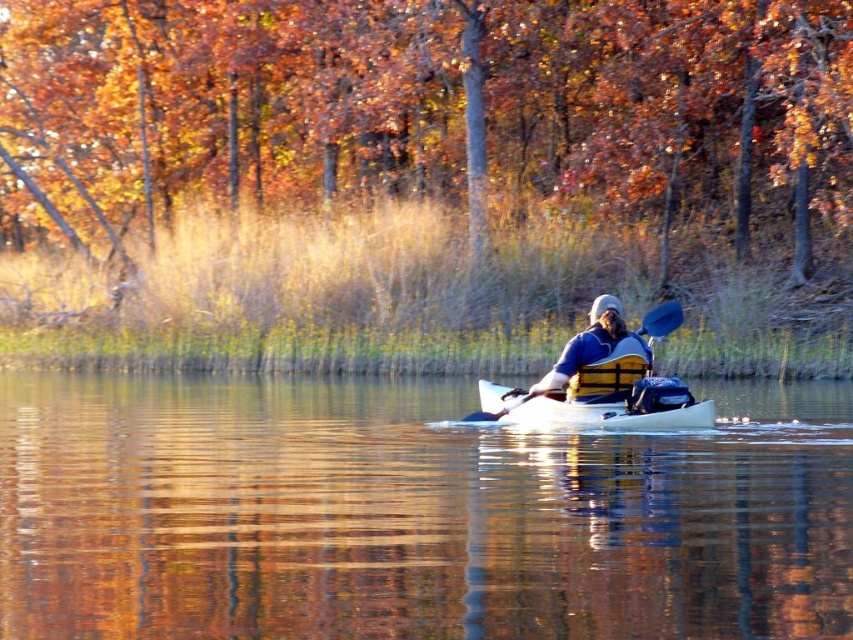
Which of these two, brown matte tree at upper center or white matte canoe at center, stands shorter?

Standing shorter between the two is white matte canoe at center.

The width and height of the screenshot is (853, 640). In order to click on brown matte tree at upper center in this screenshot , I will do `click(430, 108)`.

The image size is (853, 640). What do you see at coordinates (430, 108) in the screenshot?
I see `brown matte tree at upper center` at bounding box center [430, 108].

You are a GUI agent. You are given a task and a screenshot of the screen. Output one action in this format:
    pyautogui.click(x=<x>, y=<y>)
    Task: Click on the brown matte tree at upper center
    The image size is (853, 640).
    Given the screenshot: What is the action you would take?
    pyautogui.click(x=430, y=108)

Does point (109, 464) come behind point (654, 413)?

No, (109, 464) is closer to viewer.

Is white glossy kayak at center above white matte canoe at center?

Actually, white glossy kayak at center is below white matte canoe at center.

Who is more distant from viewer, [343,449] or [700,413]?

Point [343,449]

This screenshot has height=640, width=853. What are the coordinates of `white glossy kayak at center` in the screenshot? It's located at (412, 515).

Does white glossy kayak at center come in front of blue fabric life vest at center?

A: That is True.

Measure the distance from white glossy kayak at center to blue fabric life vest at center.

white glossy kayak at center and blue fabric life vest at center are 13.10 feet apart from each other.

In order to click on white glossy kayak at center in this screenshot , I will do `click(412, 515)`.